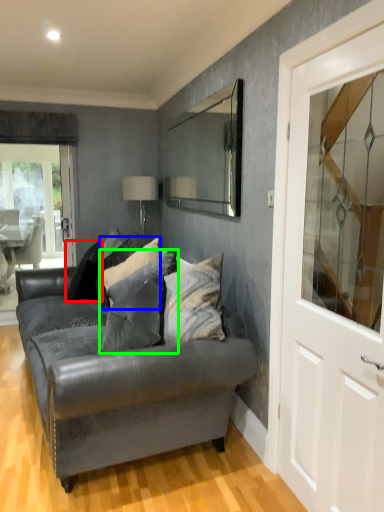
Question: Which object is the closest to the pillow (highlighted by a red box)? Choose among these: pillow (highlighted by a blue box) or pillow (highlighted by a green box).

Choices:
 (A) pillow
 (B) pillow

Answer: (A)